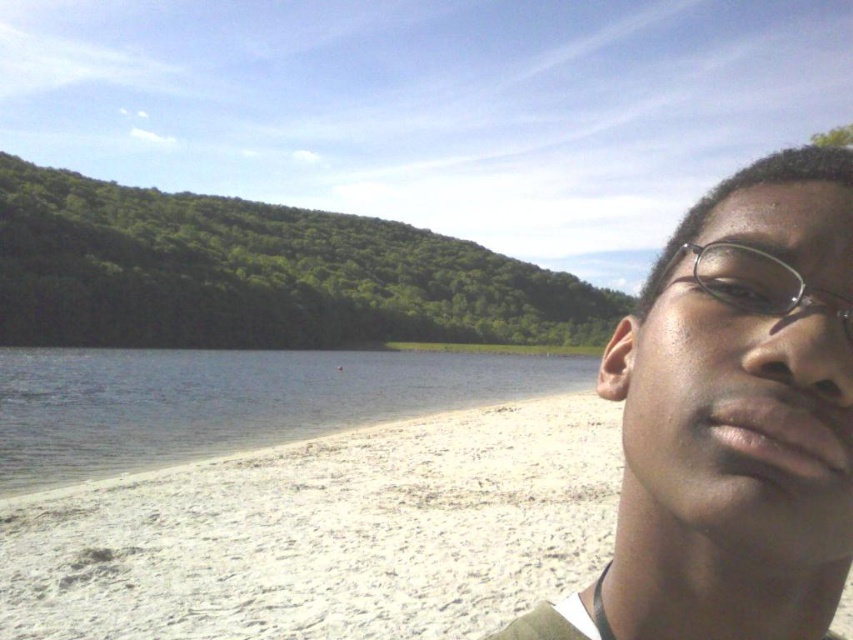
Which is in front, point (834, 216) or point (340, 410)?

Point (834, 216) is in front.

Is matte black glasses at upper right shorter than clear water at lower left?

In fact, matte black glasses at upper right may be taller than clear water at lower left.

The height and width of the screenshot is (640, 853). Describe the element at coordinates (732, 420) in the screenshot. I see `matte black glasses at upper right` at that location.

The height and width of the screenshot is (640, 853). I want to click on matte black glasses at upper right, so click(732, 420).

Does clear water at lower left have a greater width compared to clear plastic glasses at upper right?

Correct, the width of clear water at lower left exceeds that of clear plastic glasses at upper right.

Does point (219, 444) come closer to viewer compared to point (679, 257)?

No, it is not.

Where is `clear water at lower left`? The image size is (853, 640). clear water at lower left is located at coordinates (228, 401).

Which is more to the left, white sandy beach at lower left or clear water at lower left?

clear water at lower left

Is white sandy beach at lower left positioned behind clear water at lower left?

No, white sandy beach at lower left is closer to the viewer.

This screenshot has width=853, height=640. Describe the element at coordinates (326, 532) in the screenshot. I see `white sandy beach at lower left` at that location.

What are the coordinates of `white sandy beach at lower left` in the screenshot? It's located at (326, 532).